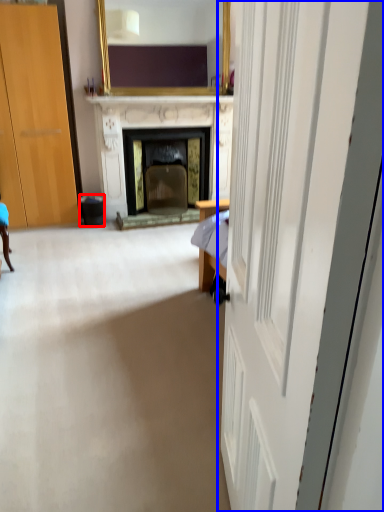
Question: Which point is closer to the camera, trash bin/can (highlighted by a red box) or door (highlighted by a blue box)?

Choices:
 (A) trash bin/can
 (B) door

Answer: (B)